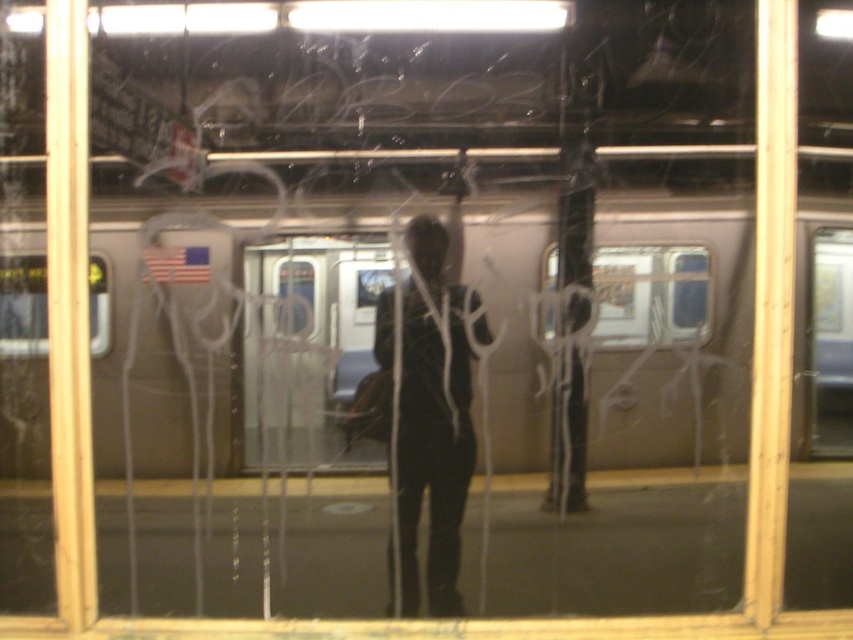
Question: Which point is farther from the camera taking this photo?

Choices:
 (A) (16, 456)
 (B) (463, 490)

Answer: (B)

Question: Does silver metallic train at center appear over clear glass train window at center?

Choices:
 (A) yes
 (B) no

Answer: (B)

Question: Which object is positioned farthest from the black matte clothing at center?

Choices:
 (A) clear glass train window at center
 (B) silver metallic train at center

Answer: (A)

Question: Is silver metallic train at center above black matte clothing at center?

Choices:
 (A) no
 (B) yes

Answer: (B)

Question: Is silver metallic train at center bigger than black matte clothing at center?

Choices:
 (A) yes
 (B) no

Answer: (A)

Question: Which point is closer to the camera?

Choices:
 (A) (805, 358)
 (B) (427, 372)

Answer: (A)